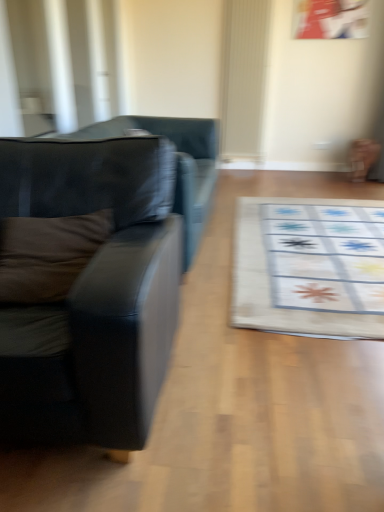
Question: Considering the relative sizes of brown fabric pillow at left and black leather couch at left, placed as the 2th studio couch when sorted from back to front, in the image provided, is brown fabric pillow at left bigger than black leather couch at left, placed as the 2th studio couch when sorted from back to front,?

Choices:
 (A) no
 (B) yes

Answer: (A)

Question: Is brown fabric pillow at left to the right of black leather couch at left, which is the 1th studio couch in front-to-back order, from the viewer's perspective?

Choices:
 (A) yes
 (B) no

Answer: (A)

Question: Is the depth of brown fabric pillow at left less than that of black leather couch at left, which is the 1th studio couch in front-to-back order?

Choices:
 (A) yes
 (B) no

Answer: (B)

Question: Does brown fabric pillow at left appear on the left side of black leather couch at left, which is the 1th studio couch in front-to-back order?

Choices:
 (A) yes
 (B) no

Answer: (B)

Question: Can you confirm if brown fabric pillow at left is wider than black leather couch at left, placed as the 2th studio couch when sorted from back to front?

Choices:
 (A) yes
 (B) no

Answer: (B)

Question: Considering their positions, is matte black couch at left, arranged as the 1th studio couch when viewed from the back, located in front of or behind brown fabric pillow at left?

Choices:
 (A) front
 (B) behind

Answer: (B)

Question: Is point (203, 157) positioned closer to the camera than point (46, 254)?

Choices:
 (A) closer
 (B) farther

Answer: (B)

Question: From the image's perspective, relative to brown fabric pillow at left, is matte black couch at left, which ranks as the 2th studio couch in front-to-back order, above or below?

Choices:
 (A) above
 (B) below

Answer: (A)

Question: From a real-world perspective, relative to brown fabric pillow at left, is matte black couch at left, which ranks as the 2th studio couch in front-to-back order, vertically above or below?

Choices:
 (A) above
 (B) below

Answer: (B)

Question: Based on their sizes in the image, would you say white fabric mat at center is bigger or smaller than black leather couch at left, which is the 1th studio couch in front-to-back order?

Choices:
 (A) big
 (B) small

Answer: (B)

Question: From a real-world perspective, relative to black leather couch at left, which is the 1th studio couch in front-to-back order, is white fabric mat at center vertically above or below?

Choices:
 (A) below
 (B) above

Answer: (A)

Question: Considering the positions of white fabric mat at center and black leather couch at left, placed as the 2th studio couch when sorted from back to front, in the image, is white fabric mat at center wider or thinner than black leather couch at left, placed as the 2th studio couch when sorted from back to front,?

Choices:
 (A) wide
 (B) thin

Answer: (A)

Question: Is white fabric mat at center taller or shorter than black leather couch at left, which is the 1th studio couch in front-to-back order?

Choices:
 (A) short
 (B) tall

Answer: (A)

Question: From the image's perspective, is black leather couch at left, placed as the 2th studio couch when sorted from back to front, located above or below brown fabric pillow at left?

Choices:
 (A) above
 (B) below

Answer: (B)

Question: In the image, is black leather couch at left, which is the 1th studio couch in front-to-back order, on the left side or the right side of brown fabric pillow at left?

Choices:
 (A) left
 (B) right

Answer: (A)